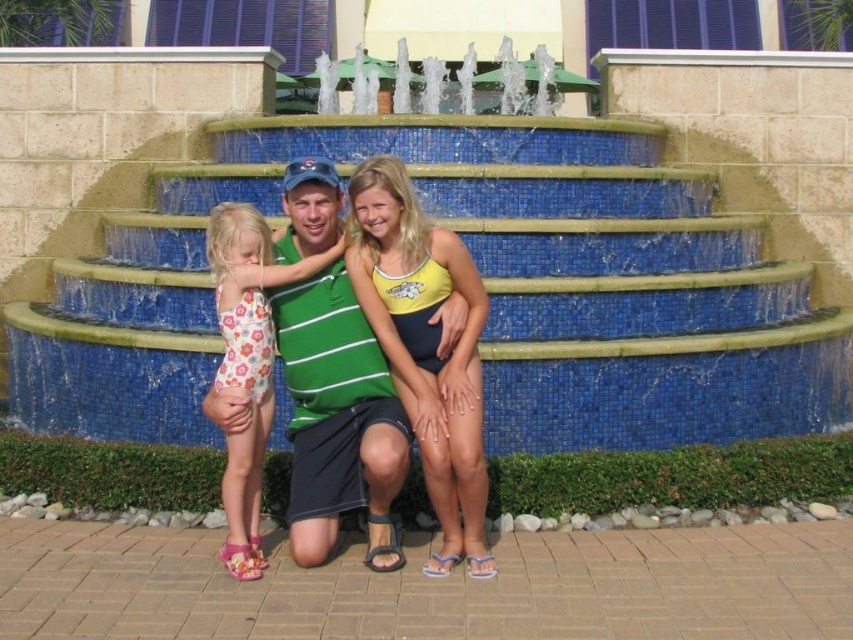
Does point (107, 252) come farther from viewer compared to point (357, 477)?

Yes.

Between blue mosaic stairs at center and green striped shirt at center, which one has more height?

With more height is blue mosaic stairs at center.

Between point (321, 364) and point (297, 464), which one is positioned in front?

Positioned in front is point (297, 464).

Identify the location of blue mosaic stairs at center. (486, 291).

Does green striped shirt at center appear on the left side of yellow fabric bikini top at center?

Indeed, green striped shirt at center is positioned on the left side of yellow fabric bikini top at center.

Where is `green striped shirt at center`? The image size is (853, 640). green striped shirt at center is located at coordinates (338, 419).

The image size is (853, 640). What do you see at coordinates (338, 419) in the screenshot?
I see `green striped shirt at center` at bounding box center [338, 419].

The width and height of the screenshot is (853, 640). What are the coordinates of `green striped shirt at center` in the screenshot? It's located at (338, 419).

Locate an element on the screen. Image resolution: width=853 pixels, height=640 pixels. green striped shirt at center is located at coordinates (338, 419).